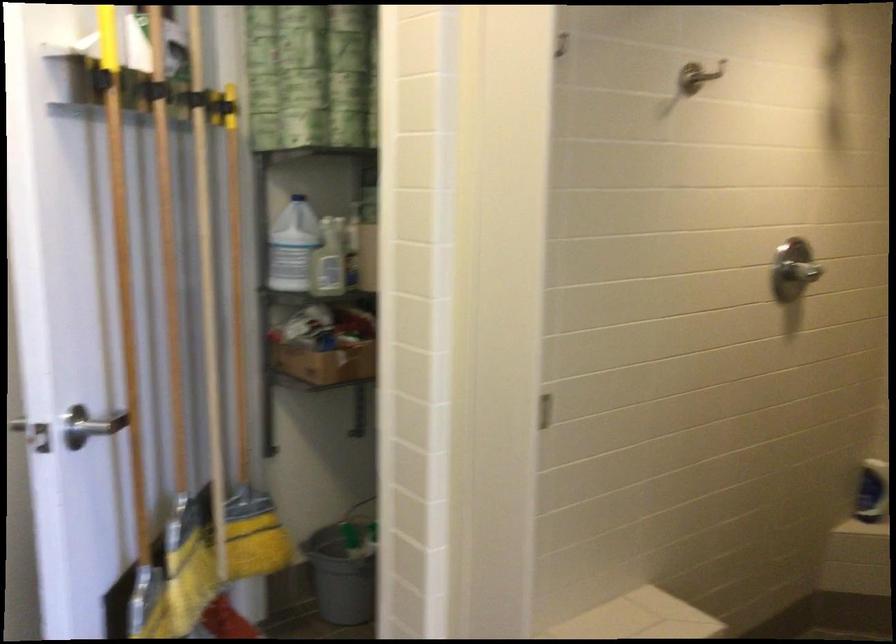
This screenshot has width=896, height=644. I want to click on grey plastic bucket, so click(x=341, y=573).